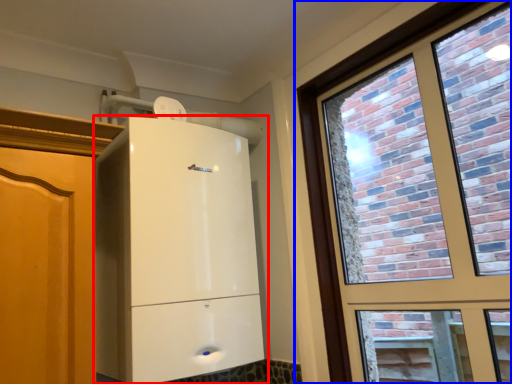
Question: Which object appears farthest to the camera in this image, cupboard (highlighted by a red box) or window (highlighted by a blue box)?

Choices:
 (A) cupboard
 (B) window

Answer: (A)